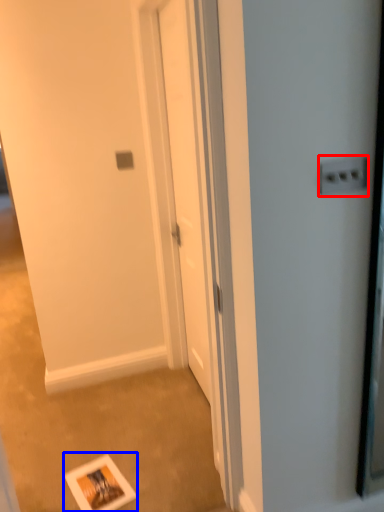
Question: Which point is further to the camera, electric outlet (highlighted by a red box) or postcard (highlighted by a blue box)?

Choices:
 (A) electric outlet
 (B) postcard

Answer: (B)